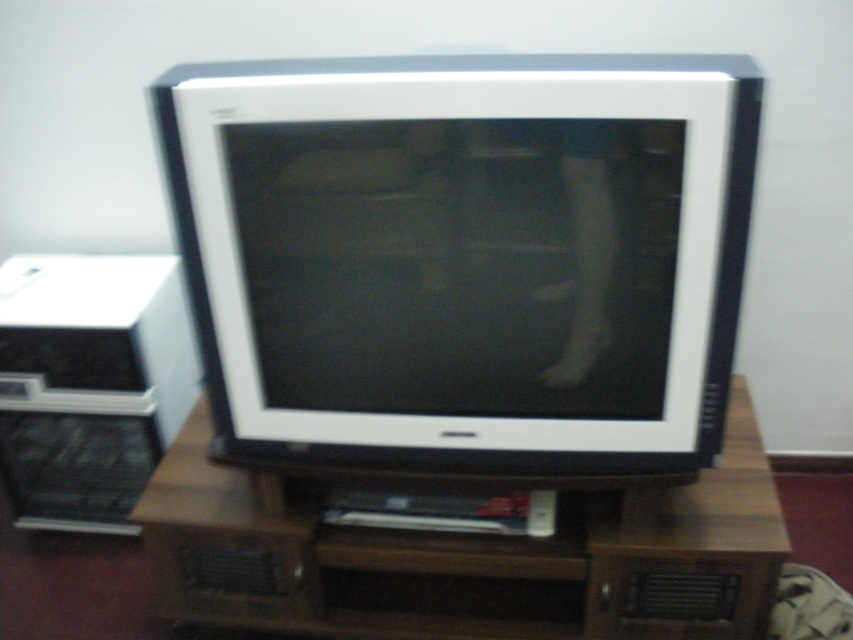
Question: Which object is farther from the camera taking this photo?

Choices:
 (A) white plastic monitor at center
 (B) brown wood entertainment center at center

Answer: (B)

Question: Observing the image, what is the correct spatial positioning of white plastic monitor at center in reference to brown wood entertainment center at center?

Choices:
 (A) right
 (B) left

Answer: (A)

Question: Can you confirm if white plastic monitor at center is smaller than brown wood entertainment center at center?

Choices:
 (A) no
 (B) yes

Answer: (B)

Question: Which of the following is the closest to the observer?

Choices:
 (A) brown wood entertainment center at center
 (B) white plastic monitor at center

Answer: (B)

Question: Is white plastic monitor at center above brown wood entertainment center at center?

Choices:
 (A) yes
 (B) no

Answer: (A)